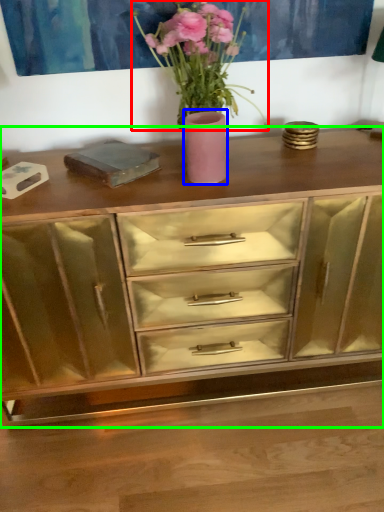
Question: Which object is the farthest from floral arrangement (highlighted by a red box)? Choose among these: vase (highlighted by a blue box) or chest of drawers (highlighted by a green box).

Choices:
 (A) vase
 (B) chest of drawers

Answer: (B)